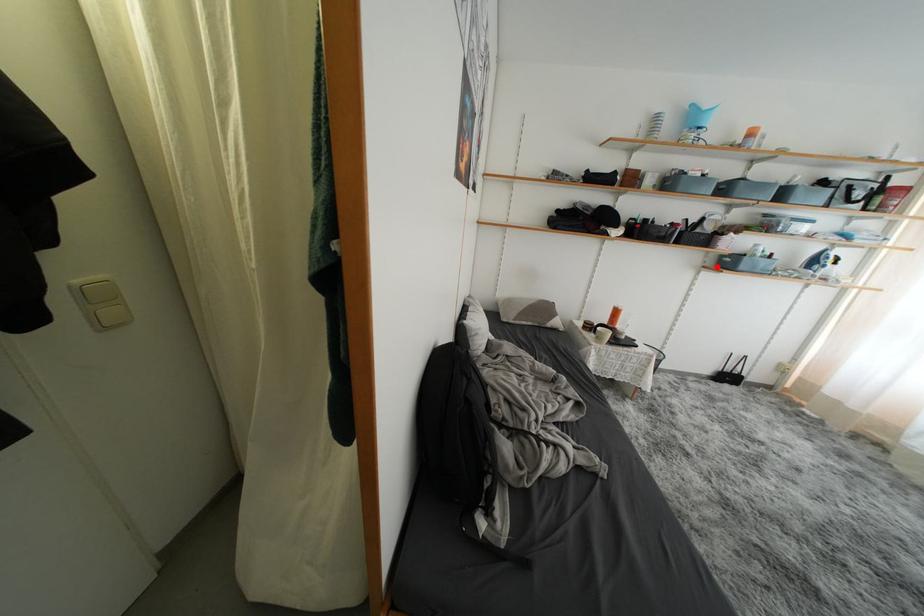
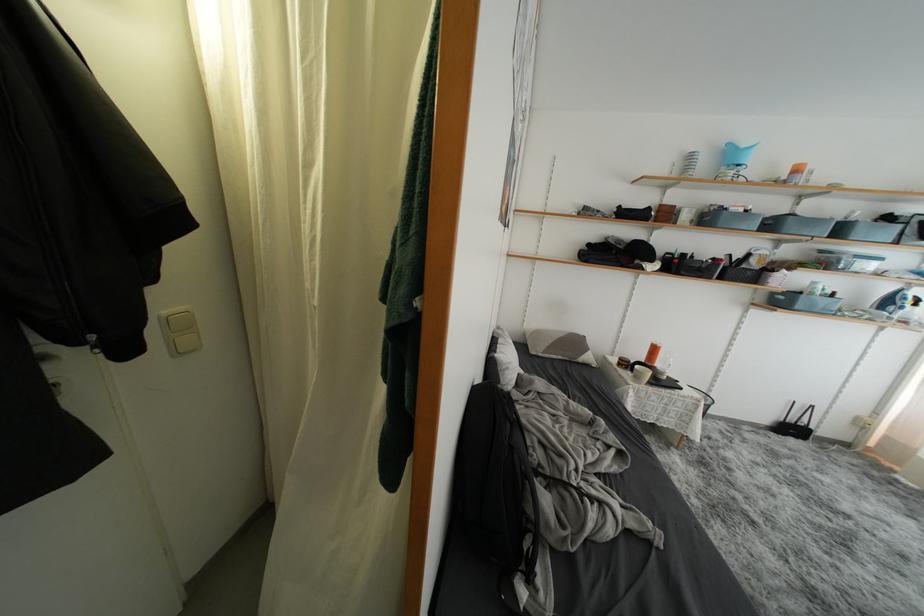
Locate, in the second image, the point that corresponds to the highlighted location in the first image.

(767, 304)